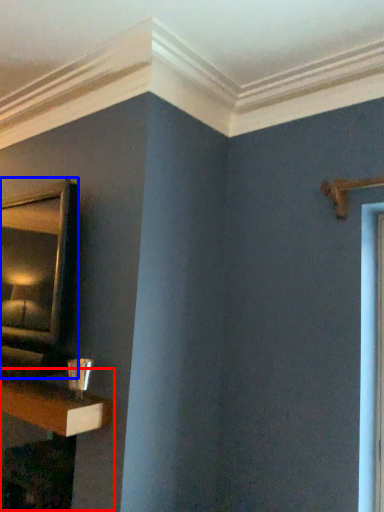
Question: Among these objects, which one is nearest to the camera, table (highlighted by a red box) or mirror (highlighted by a blue box)?

Choices:
 (A) table
 (B) mirror

Answer: (B)